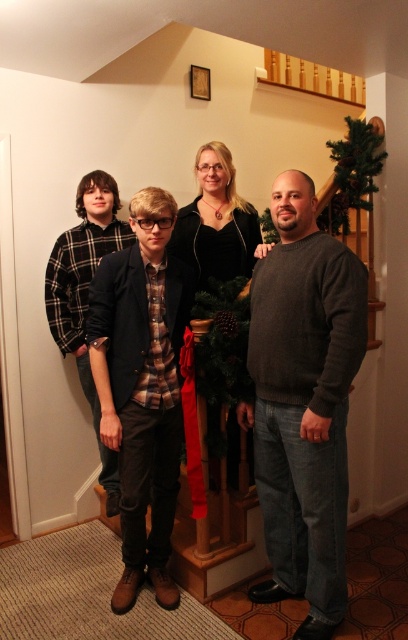
Does dark brown leather jacket at center have a greater width compared to flannel shirt at left?

In fact, dark brown leather jacket at center might be narrower than flannel shirt at left.

Is dark brown leather jacket at center further to camera compared to flannel shirt at left?

No, it is not.

Is point (133, 330) more distant than point (95, 250)?

No, it is not.

The height and width of the screenshot is (640, 408). Identify the location of dark brown leather jacket at center. (141, 387).

Does dark gray sweater at center have a greater width compared to flannel shirt at left?

No.

Who is shorter, dark gray sweater at center or flannel shirt at left?

flannel shirt at left

Measure the distance between dark gray sweater at center and camera.

dark gray sweater at center is 6.11 feet from camera.

Locate an element on the screen. The height and width of the screenshot is (640, 408). dark gray sweater at center is located at coordinates (306, 387).

Can you confirm if dark gray sweater at right is shorter than dark gray sweater at center?

Yes, dark gray sweater at right is shorter than dark gray sweater at center.

This screenshot has width=408, height=640. I want to click on dark gray sweater at right, so click(x=303, y=403).

Between point (292, 573) and point (292, 365), which one is positioned in front?

Point (292, 365) is in front.

Find the location of a particular element. The height and width of the screenshot is (640, 408). dark gray sweater at right is located at coordinates (303, 403).